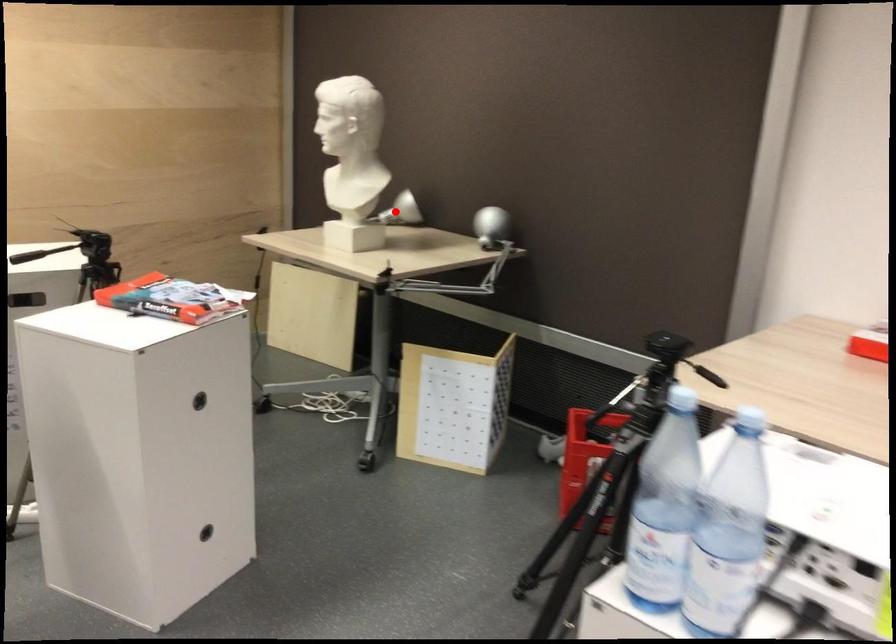
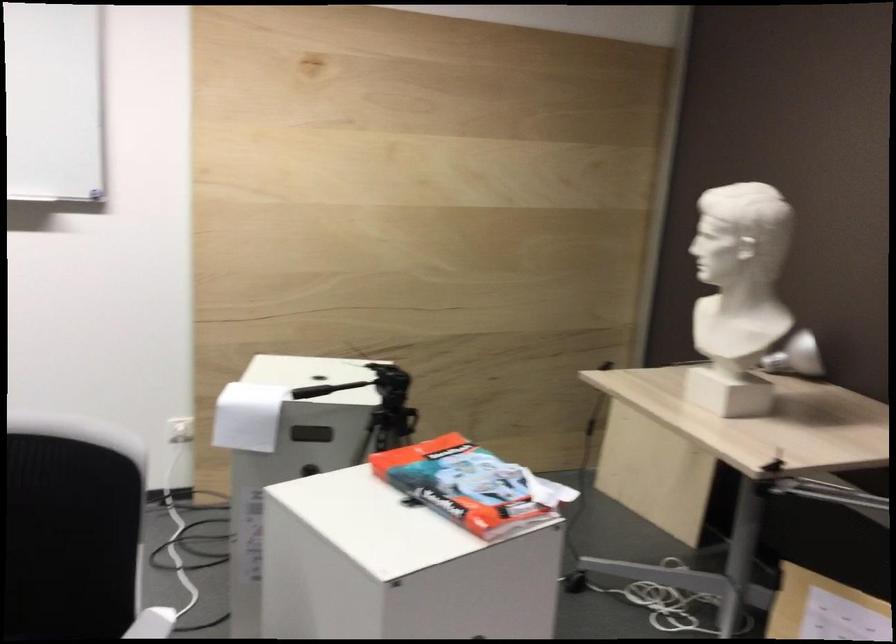
Question: I am providing you with two images of the same scene from different viewpoints. Image1 has a red point marked. In image2, the corresponding 3D location appears at what relative position? Reply with the corresponding letter.

Choices:
 (A) Closer
 (B) Farther

Answer: (A)